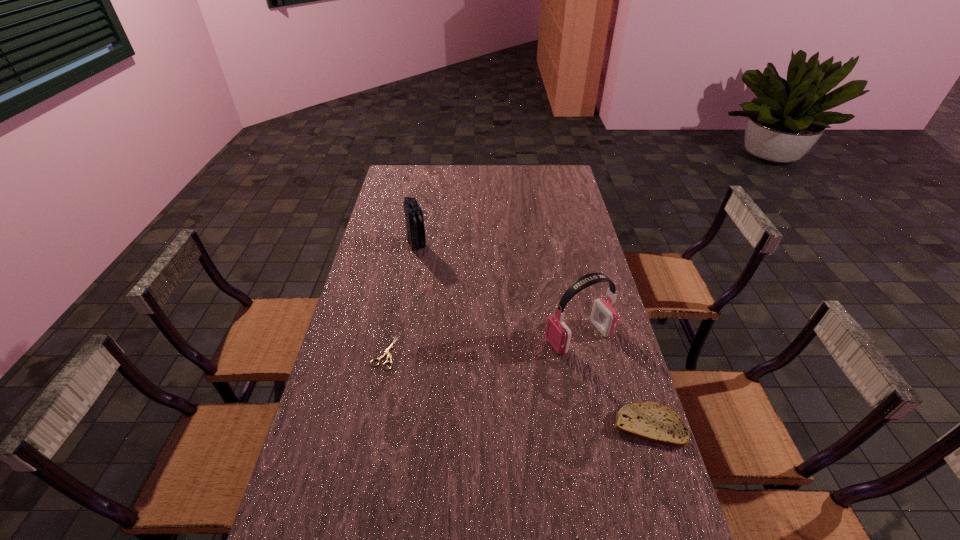
Where is `vacant space at the right edge of the desktop`? vacant space at the right edge of the desktop is located at coordinates (648, 443).

Image resolution: width=960 pixels, height=540 pixels. In order to click on free spot between the earphone and the shortest object in this screenshot , I will do `click(482, 345)`.

Locate an element on the screen. Image resolution: width=960 pixels, height=540 pixels. empty location between the clutch bag and the tallest object is located at coordinates (498, 291).

Locate an element on the screen. The width and height of the screenshot is (960, 540). free point between the tallest object and the clutch bag is located at coordinates (498, 291).

Find the location of a particular element. The image size is (960, 540). vacant space in between the nearest object and the shears is located at coordinates (516, 389).

Find the location of a particular element. Image resolution: width=960 pixels, height=540 pixels. vacant space that is in between the tallest object and the shortest object is located at coordinates (482, 345).

This screenshot has width=960, height=540. What are the coordinates of `free spot between the shortest object and the second shortest object` in the screenshot? It's located at (516, 389).

I want to click on free space between the shortest object and the tallest object, so click(x=482, y=345).

Find the location of a particular element. The height and width of the screenshot is (540, 960). unoccupied position between the pita bread and the shortest object is located at coordinates click(x=516, y=389).

In order to click on empty space between the farthest object and the tallest object in this screenshot , I will do `click(498, 291)`.